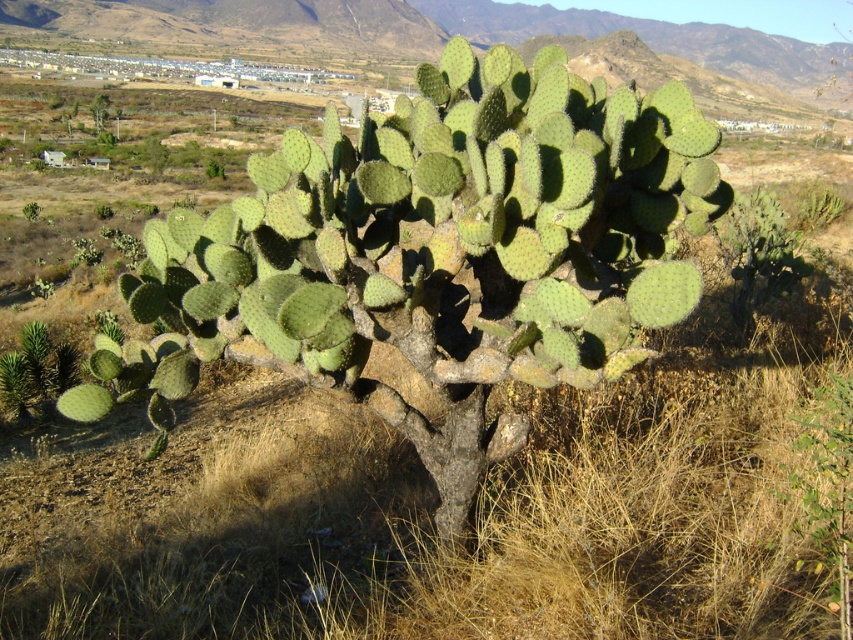
You are a photographer standing at a safe distance from the green spiny cactus at center. You want to take a photo of it without getting too close to avoid the spines. If your camera can focus on objects up to 10 feet away, will you be able to take a clear photo from your current position?

The green spiny cactus at center is 8.19 feet away from the camera. Since the camera can focus up to 10 feet, you can take a clear photo from your current position without moving closer.

You are a hiker in the desert and want to find the tallest green spiny cactus. Which one should you look for between the green spiny cactus at center and the green spiny cactus at upper left?

The green spiny cactus at upper left is taller than the green spiny cactus at center, so you should look for the green spiny cactus at upper left.